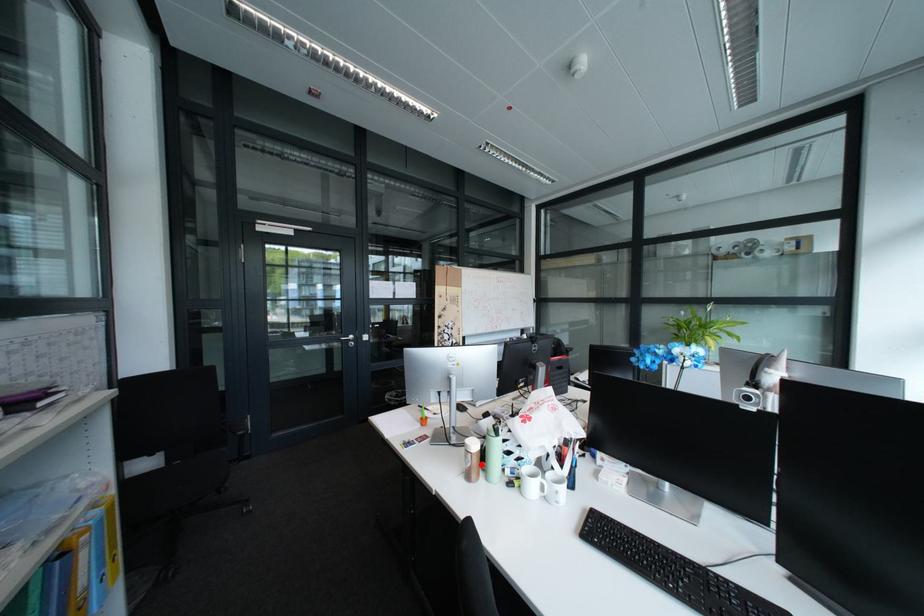
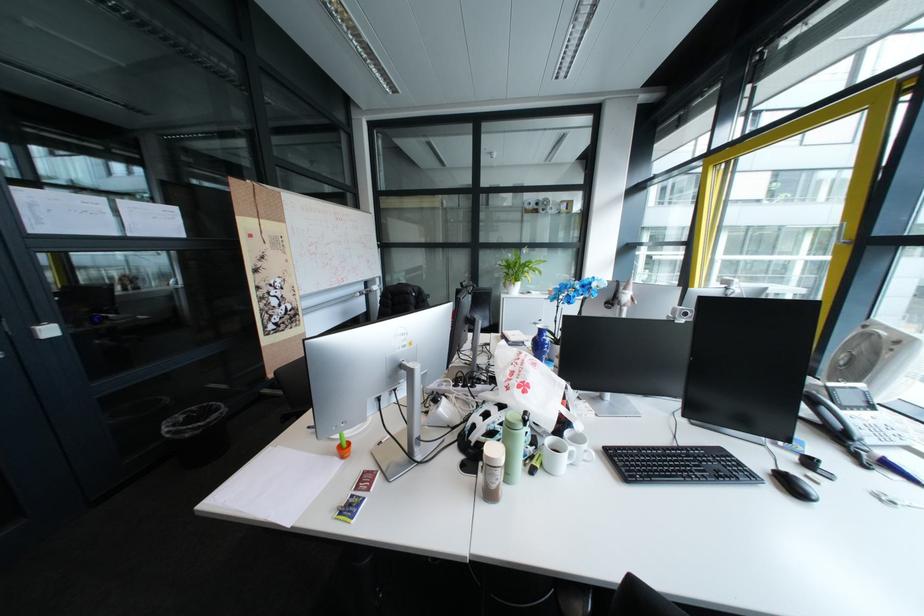
In the second image, find the point that corresponds to the highlighted location in the first image.

(507, 484)